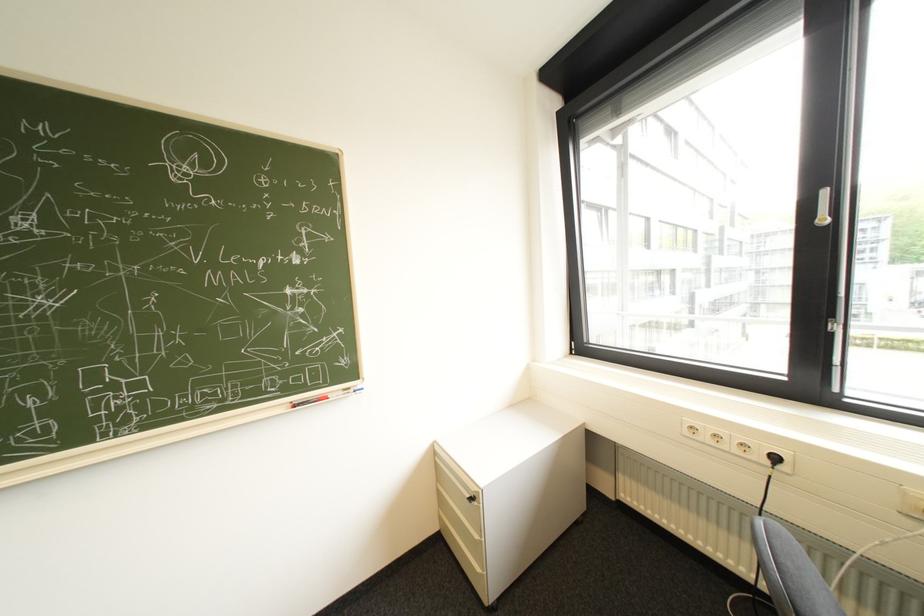
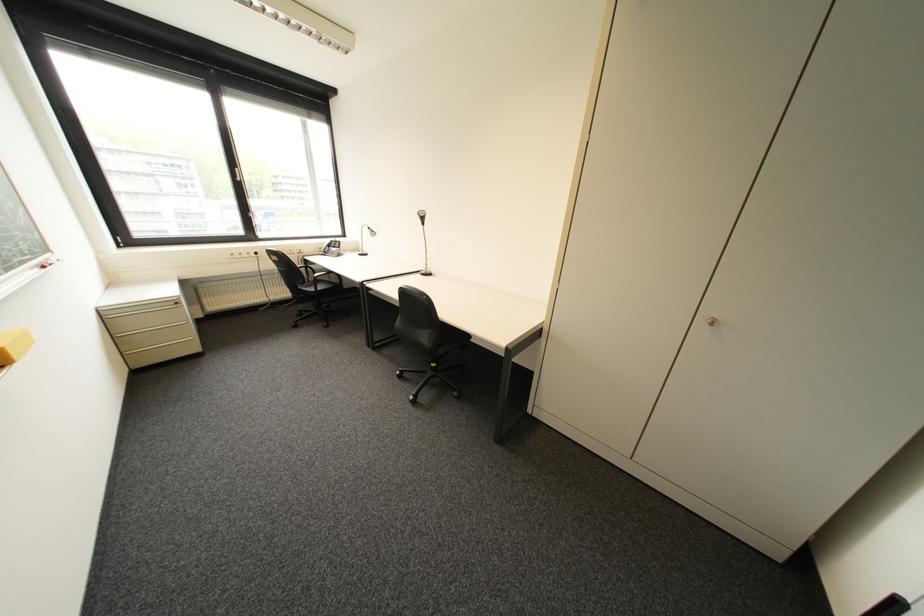
Locate, in the second image, the point that corresponds to [447,480] in the first image.

(122, 336)